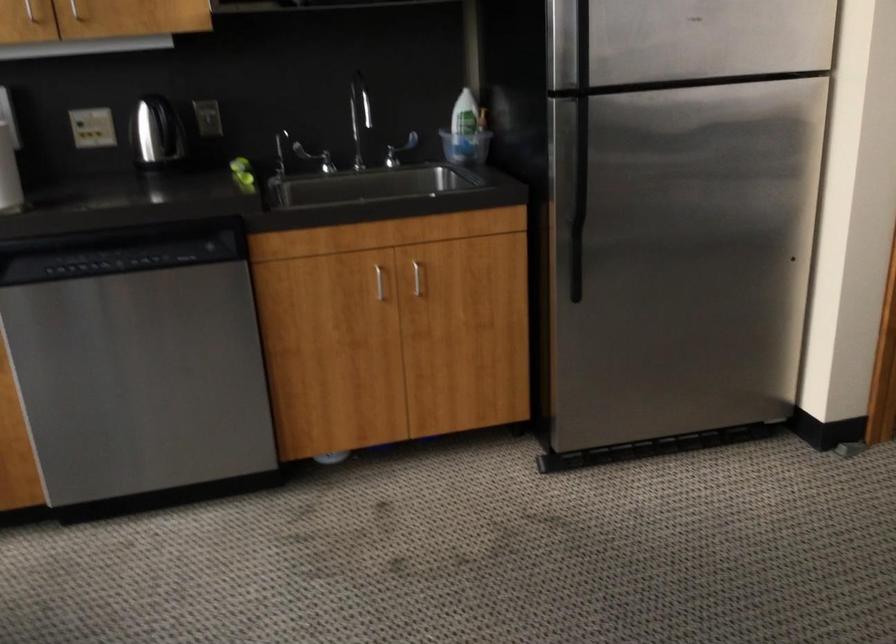
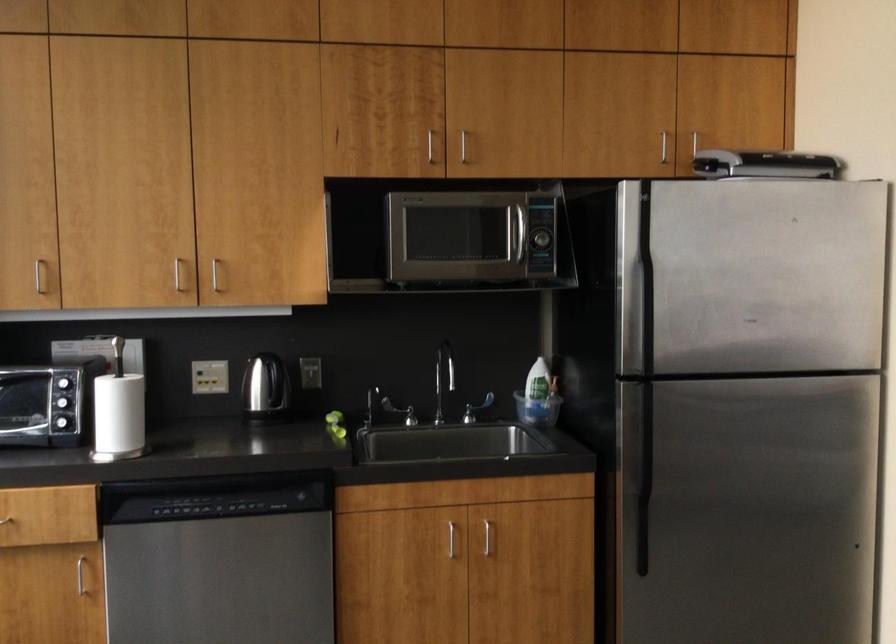
The point at (159, 136) is marked in the first image. Where is the corresponding point in the second image?

(266, 391)